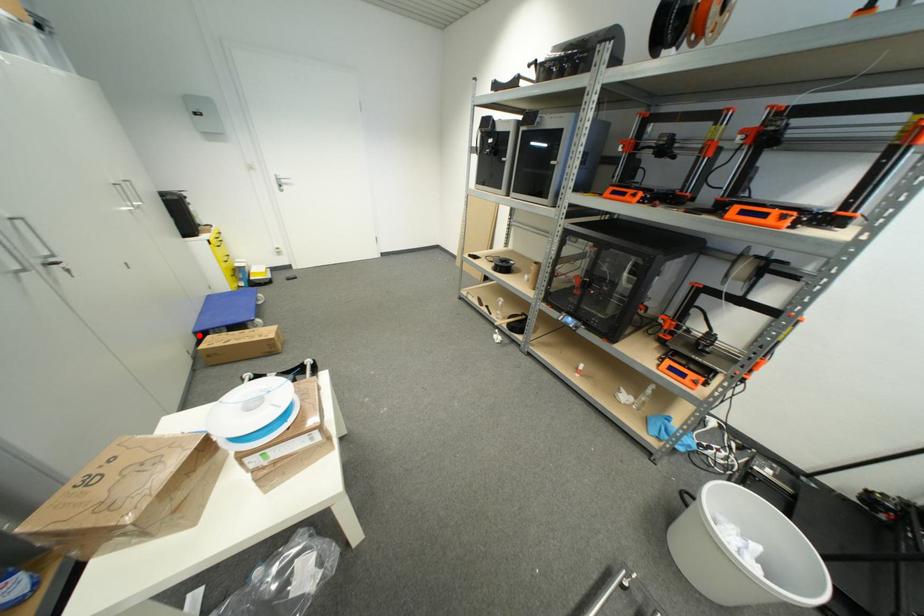
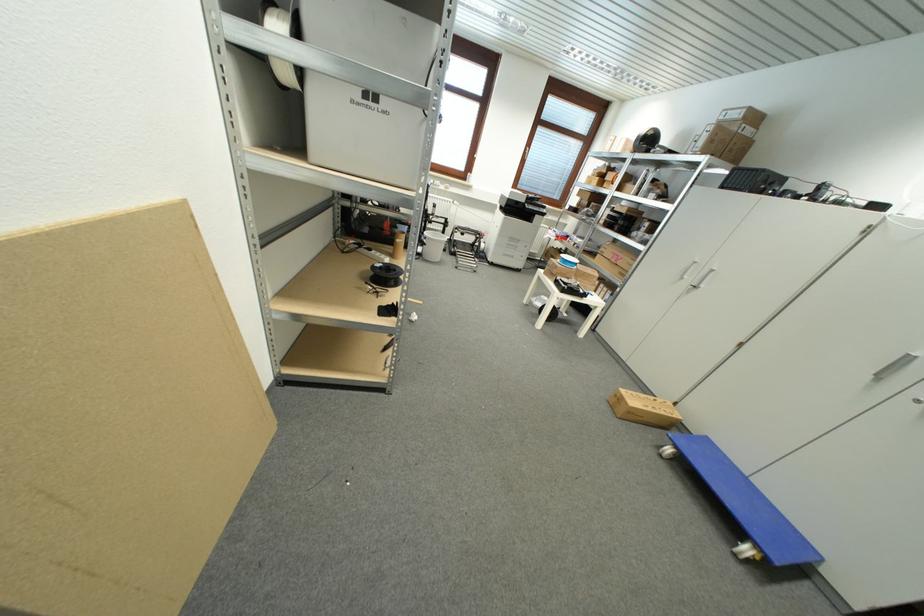
Where in the second image is the point corresponding to the highlighted location from the first image?

(711, 440)